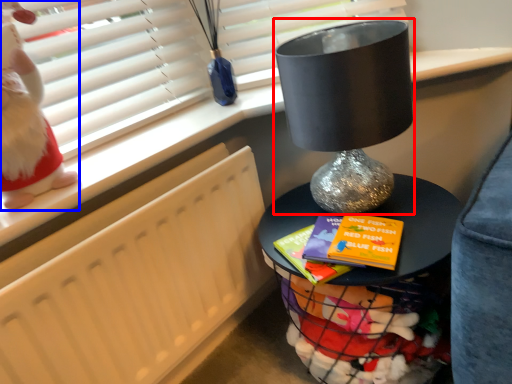
Question: Among these objects, which one is nearest to the camera, table lamp (highlighted by a red box) or doll (highlighted by a blue box)?

Choices:
 (A) table lamp
 (B) doll

Answer: (B)